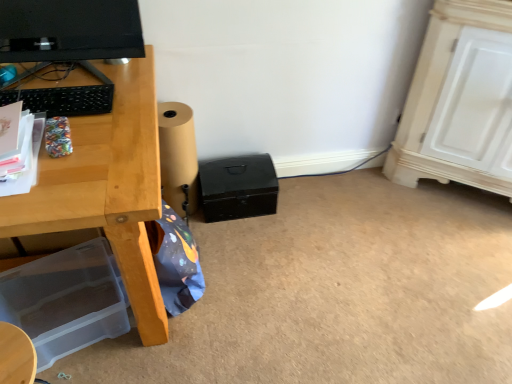
The height and width of the screenshot is (384, 512). Identify the location of vacant space situated above black matte box at center, the 1th box positioned from the top (from a real-world perspective). (232, 174).